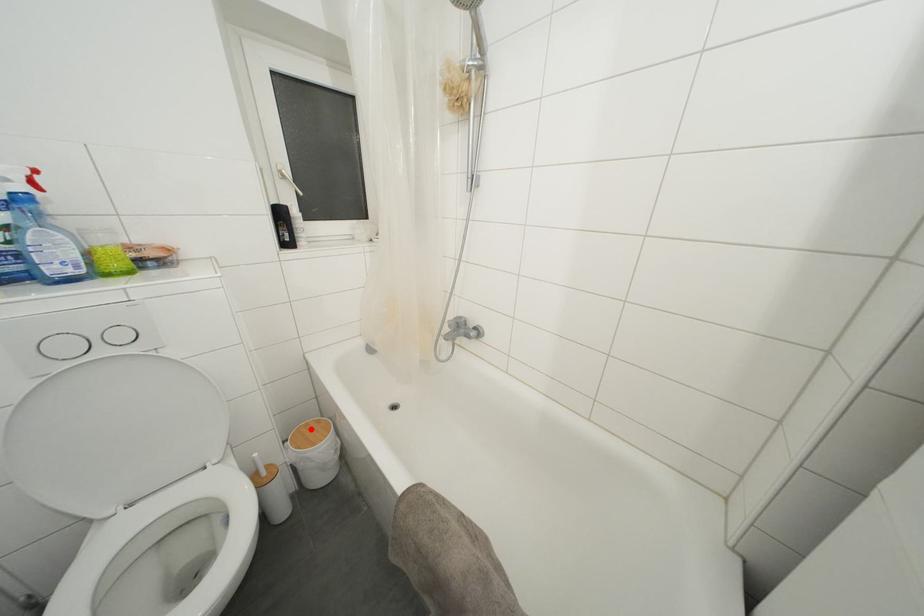
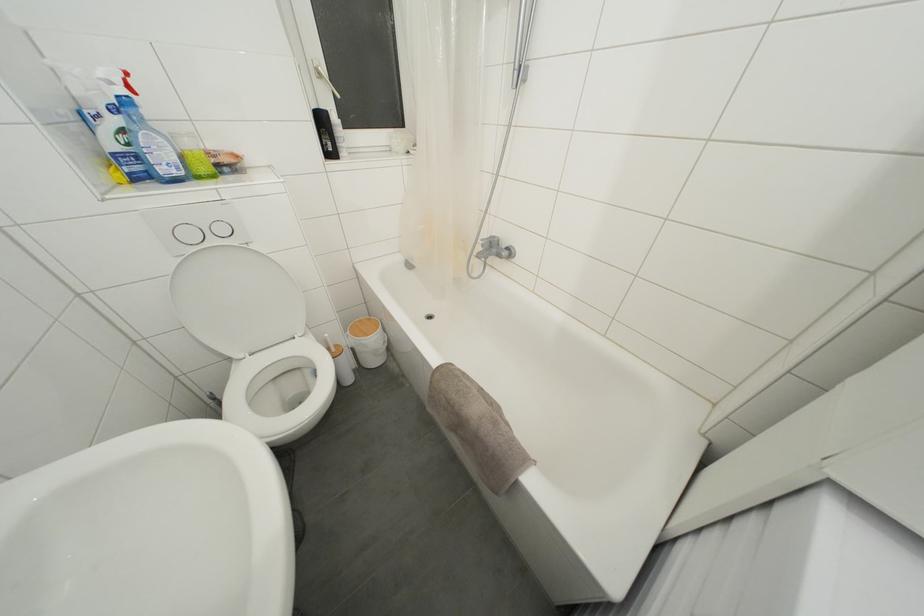
Question: I am providing you with two images of the same scene from different viewpoints. In image1, a red point is highlighted. Considering the same 3D point in image2, which of the following is correct?

Choices:
 (A) It is closer
 (B) It is farther

Answer: (A)